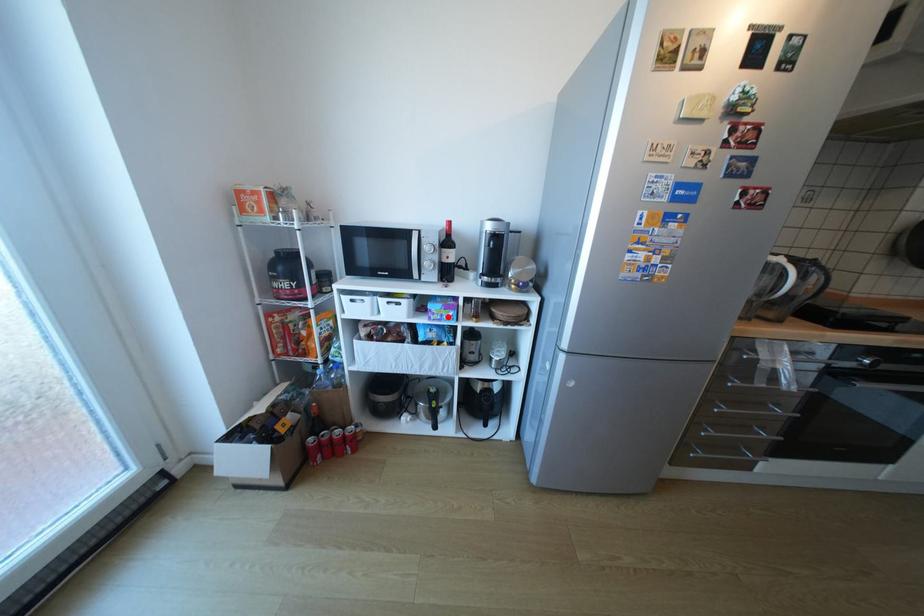
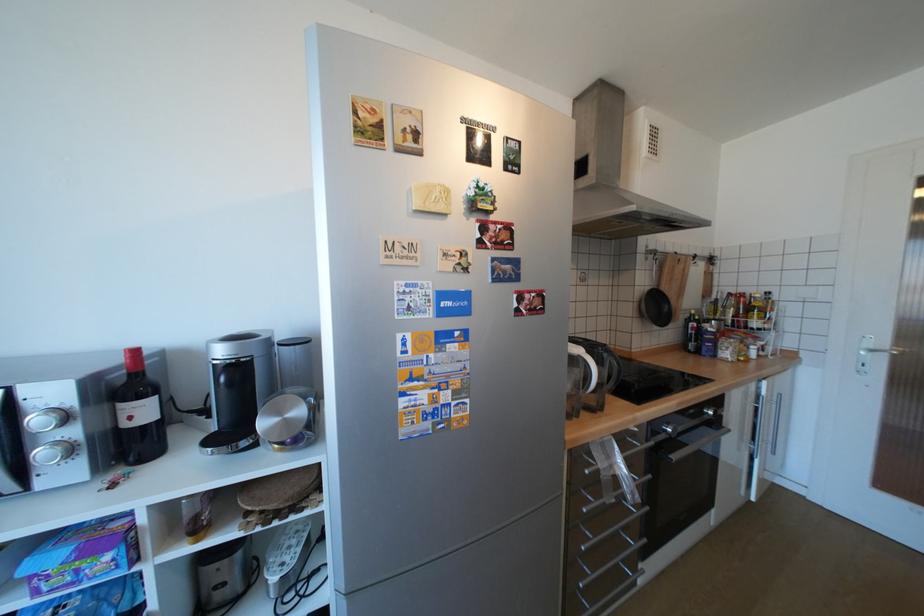
Question: I am providing you with two images of the same scene from different viewpoints. Given a red point in image1, look at the same physical point in image2. Is it:

Choices:
 (A) Closer to the viewpoint
 (B) Farther from the viewpoint

Answer: (A)